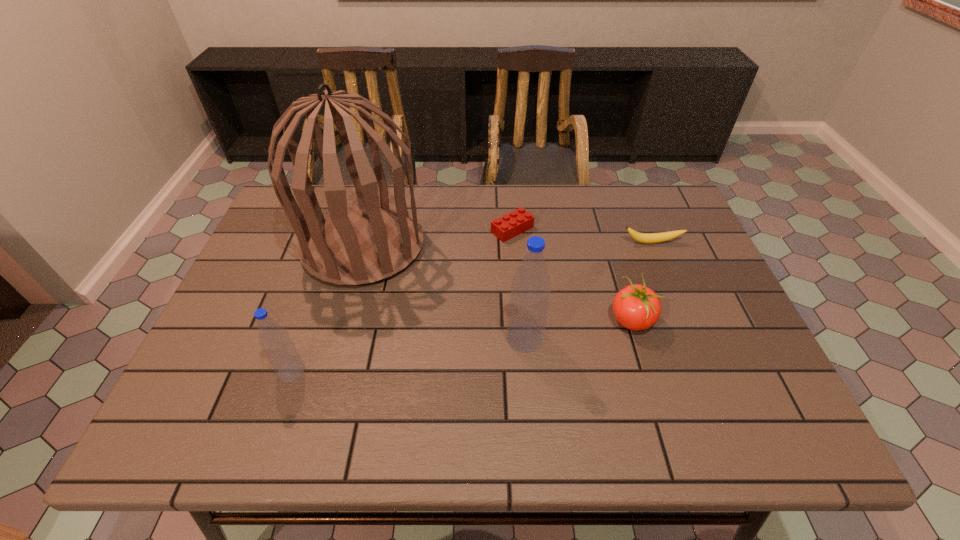
This screenshot has height=540, width=960. What are the coordinates of `blank space at the far edge of the desktop` in the screenshot? It's located at (459, 232).

You are a GUI agent. You are given a task and a screenshot of the screen. Output one action in this format:
    pyautogui.click(x=<x>, y=<y>)
    Task: Click on the free space at the near edge of the desktop
    This screenshot has height=540, width=960.
    Given the screenshot: What is the action you would take?
    pyautogui.click(x=506, y=401)

Image resolution: width=960 pixels, height=540 pixels. In order to click on free region at the left edge of the desktop in this screenshot , I will do `click(275, 244)`.

In the image, there is a desktop. At what (x,y) coordinates should I click in order to perform the action: click on blank space at the near right corner. Please return your answer as a coordinate pair (x, y). Looking at the image, I should click on (743, 377).

Where is `vacant space that's between the tomato and the taller water bottle`? vacant space that's between the tomato and the taller water bottle is located at coordinates (578, 329).

Locate an element on the screen. unoccupied area between the left water bottle and the tallest object is located at coordinates (327, 308).

I want to click on free area in between the shortest object and the tallest object, so tap(438, 238).

Identify the location of free spot between the tomato and the fifth tallest object. (641, 281).

Locate an element on the screen. This screenshot has height=540, width=960. blank region between the fifth tallest object and the third shortest object is located at coordinates (641, 281).

This screenshot has height=540, width=960. What are the coordinates of `free spot between the second shortest object and the fourth tallest object` in the screenshot? It's located at (641, 281).